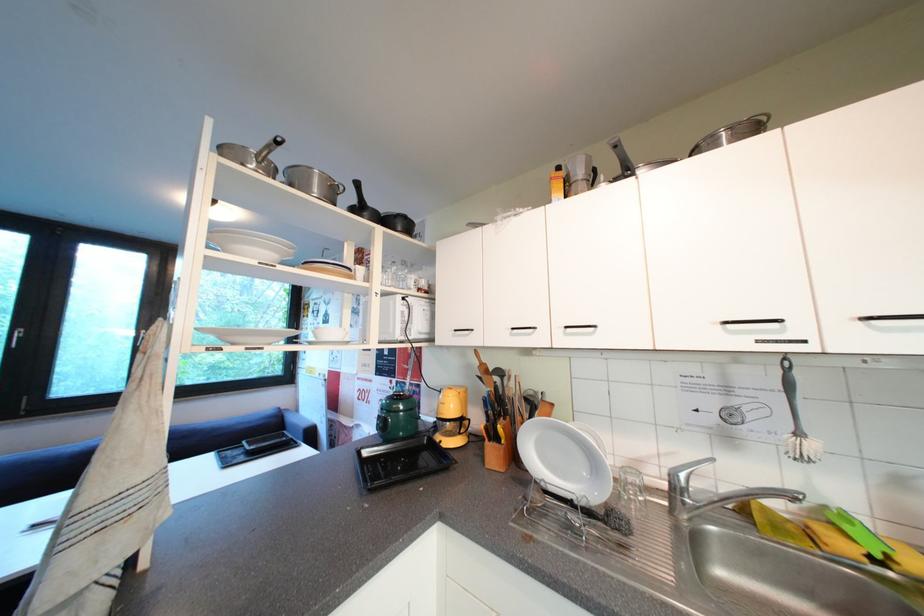
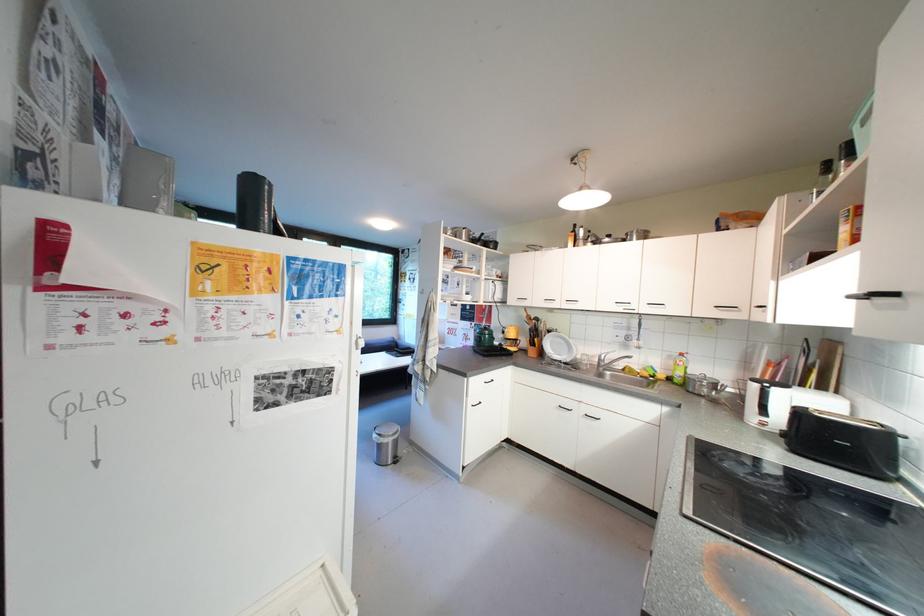
Find the pixel in the second image that matches the point at 524,459 in the first image.

(550, 355)